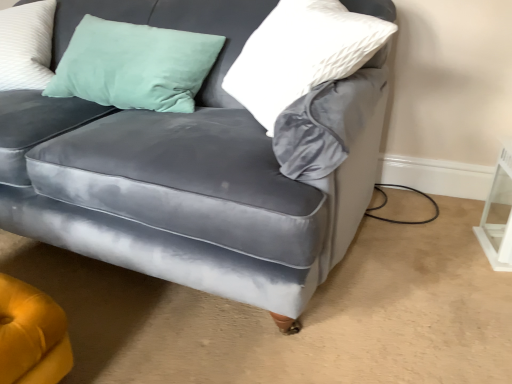
The width and height of the screenshot is (512, 384). I want to click on vacant area situated below white glossy table at lower right (from a real-world perspective), so click(x=490, y=245).